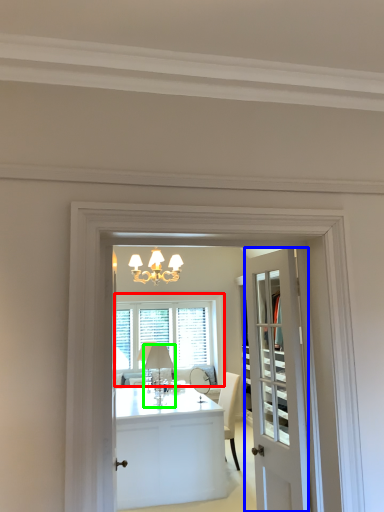
Question: Which object is positioned farthest from window (highlighted by a red box)? Select from door (highlighted by a blue box) and lamp (highlighted by a green box).

Choices:
 (A) door
 (B) lamp

Answer: (A)